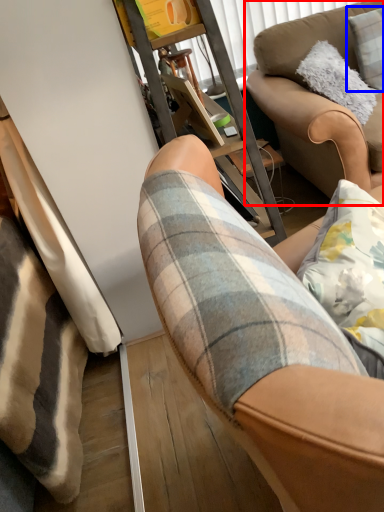
Question: Which object appears closest to the camera in this image, studio couch (highlighted by a red box) or pillow (highlighted by a blue box)?

Choices:
 (A) studio couch
 (B) pillow

Answer: (A)